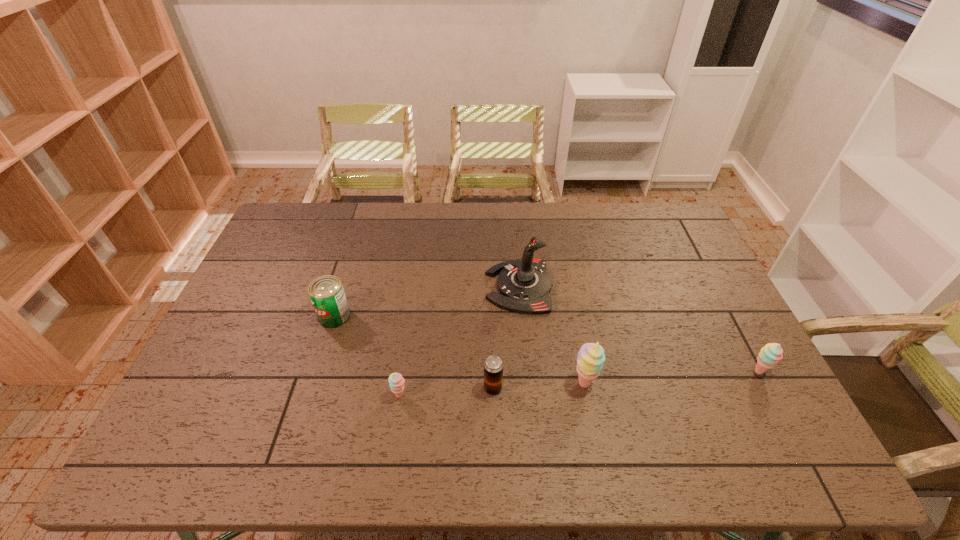
Image resolution: width=960 pixels, height=540 pixels. I want to click on free space between the tallest sherbert and the rightmost sherbert, so click(671, 377).

You are a GUI agent. You are given a task and a screenshot of the screen. Output one action in this format:
    pyautogui.click(x=<x>, y=<y>)
    Task: Click on the empty location between the can and the beer can
    The image size is (960, 540).
    Given the screenshot: What is the action you would take?
    pyautogui.click(x=414, y=352)

At what (x,y) coordinates should I click in order to perform the action: click on empty space between the beer can and the joystick. Please return your answer as a coordinate pair (x, y). Image resolution: width=960 pixels, height=540 pixels. Looking at the image, I should click on (506, 338).

Locate an element on the screen. Image resolution: width=960 pixels, height=540 pixels. vacant space that's between the rightmost object and the beer can is located at coordinates (626, 380).

Image resolution: width=960 pixels, height=540 pixels. What are the coordinates of `the third closest object to the shortest sherbert` in the screenshot? It's located at (524, 285).

Where is `object that is the second closest to the joystick`? The image size is (960, 540). object that is the second closest to the joystick is located at coordinates (493, 366).

Locate an element on the screen. Image resolution: width=960 pixels, height=540 pixels. the closest sherbert to the shortest sherbert is located at coordinates (590, 358).

Identify the location of sherbert object that ranks as the second closest to the shortest sherbert. (771, 353).

Where is `vacant space that satisfies the following two spatial constraints: 1. on the back side of the second tallest sherbert; 2. on the right side of the tallest sherbert`? vacant space that satisfies the following two spatial constraints: 1. on the back side of the second tallest sherbert; 2. on the right side of the tallest sherbert is located at coordinates (581, 372).

You are a GUI agent. You are given a task and a screenshot of the screen. Output one action in this format:
    pyautogui.click(x=<x>, y=<y>)
    Task: Click on the free point that satisfies the following two spatial constraints: 1. on the front side of the fifth object from left to right; 2. on the right side of the can
    
    Given the screenshot: What is the action you would take?
    pyautogui.click(x=314, y=383)